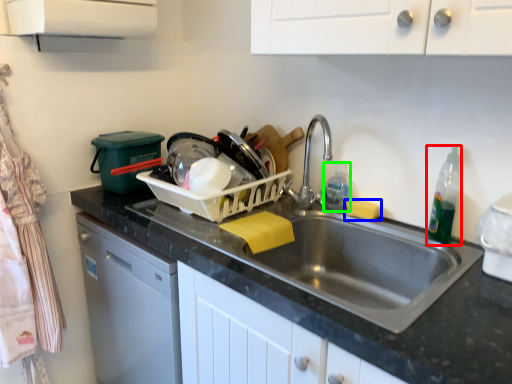
Question: Estimate the real-world distances between objects in this image. Which object is farther from bottle (highlighted by a red box), food (highlighted by a blue box) or cleaning product (highlighted by a green box)?

Choices:
 (A) food
 (B) cleaning product

Answer: (B)